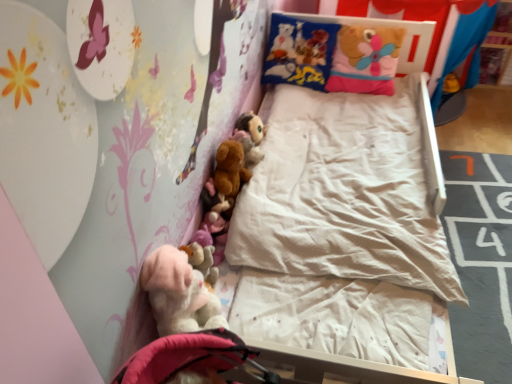
Question: Is point (262, 129) positioned closer to the camera than point (287, 79)?

Choices:
 (A) farther
 (B) closer

Answer: (B)

Question: Relative to soft plush pillow at upper right, is fuzzy brown plush at upper center, marked as the 1th toy in a top-to-bottom arrangement, in front or behind?

Choices:
 (A) front
 (B) behind

Answer: (A)

Question: Which of these objects is positioned farthest from the fuzzy brown plush at upper center, marked as the 1th toy in a top-to-bottom arrangement?

Choices:
 (A) brown plush toy at center, positioned as the 2th toy in top-to-bottom order
 (B) fluffy pink teddy at lower left
 (C) soft plush pillow at upper right
 (D) fluffy pink stuffed animal at lower left, the 3th toy in the back-to-front sequence

Answer: (B)

Question: Estimate the real-world distances between objects in this image. Which object is farther from the fluffy pink teddy at lower left?

Choices:
 (A) fuzzy brown plush at upper center, marked as the 1th toy in a top-to-bottom arrangement
 (B) soft plush pillow at upper right
 (C) brown plush toy at center, positioned as the 2th toy in top-to-bottom order
 (D) fluffy pink stuffed animal at lower left, which ranks as the third toy in top-to-bottom order

Answer: (B)